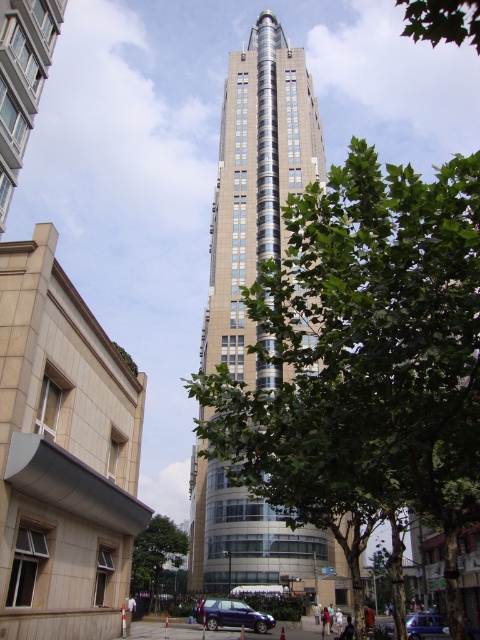
Question: Does metallic blue suv at lower center have a lesser width compared to metallic blue car at lower right?

Choices:
 (A) yes
 (B) no

Answer: (B)

Question: Is green leafy tree at center positioned at the back of green leafy tree at lower center?

Choices:
 (A) no
 (B) yes

Answer: (A)

Question: Which object appears farthest from the camera in this image?

Choices:
 (A) metallic blue suv at lower center
 (B) green leafy tree at upper right
 (C) sleek glass skyscraper at center

Answer: (A)

Question: Which of the following is the farthest from the observer?

Choices:
 (A) metallic blue suv at lower center
 (B) green leafy tree at upper right

Answer: (A)

Question: Does green leafy tree at center appear on the right side of sleek glass skyscraper at center?

Choices:
 (A) no
 (B) yes

Answer: (A)

Question: Which is nearer to the green leafy tree at lower center?

Choices:
 (A) sleek glass skyscraper at center
 (B) metallic blue suv at lower center
 (C) green leafy tree at center

Answer: (B)